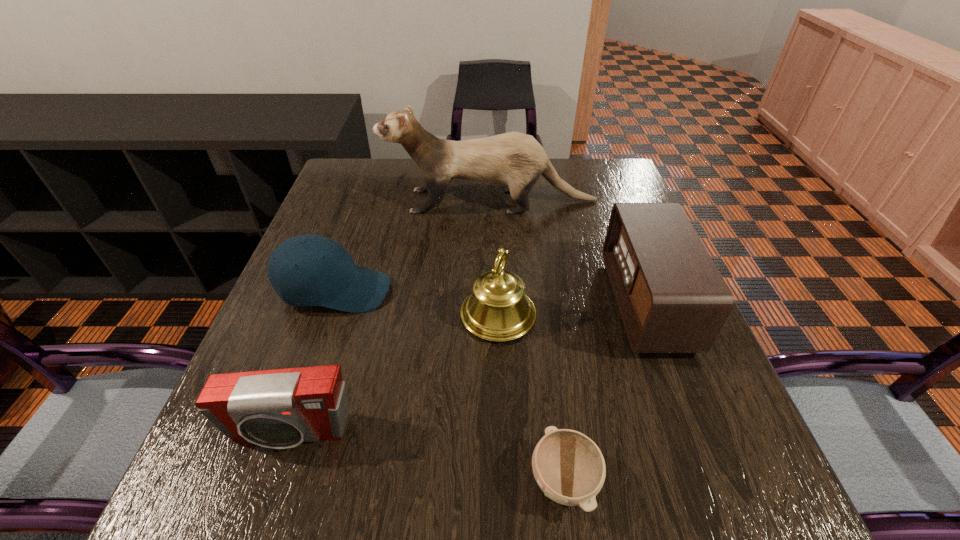
Identify which object is the fourth nearest to the shortest object. Please provide its 2D coordinates. Your answer should be formatted as a tuple, i.e. [(x, y)], where the tuple contains the x and y coordinates of a point satisfying the conditions above.

[(307, 270)]

Where is `vacant space that satisfies the following two spatial constraints: 1. on the face of the shortest object; 2. on the left side of the farthest object`? The height and width of the screenshot is (540, 960). vacant space that satisfies the following two spatial constraints: 1. on the face of the shortest object; 2. on the left side of the farthest object is located at coordinates (499, 481).

Identify the location of free space in the image that satisfies the following two spatial constraints: 1. on the face of the bowl; 2. on the right side of the farthest object. (499, 481).

The height and width of the screenshot is (540, 960). I want to click on free space that satisfies the following two spatial constraints: 1. on the face of the bell; 2. on the left side of the ferret, so click(x=493, y=315).

Find the location of a particular element. vacant space that satisfies the following two spatial constraints: 1. on the front-facing side of the camera; 2. on the right side of the bowl is located at coordinates (273, 481).